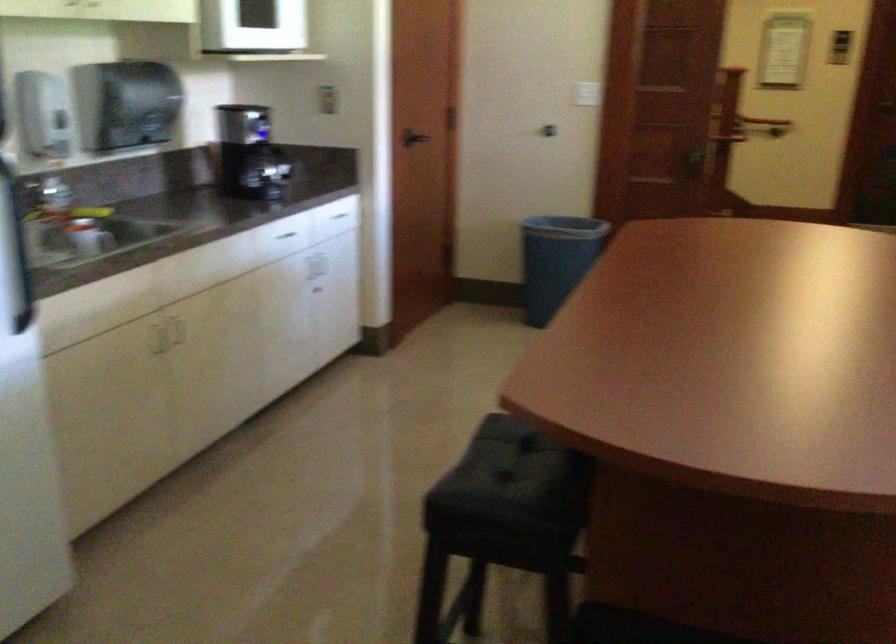
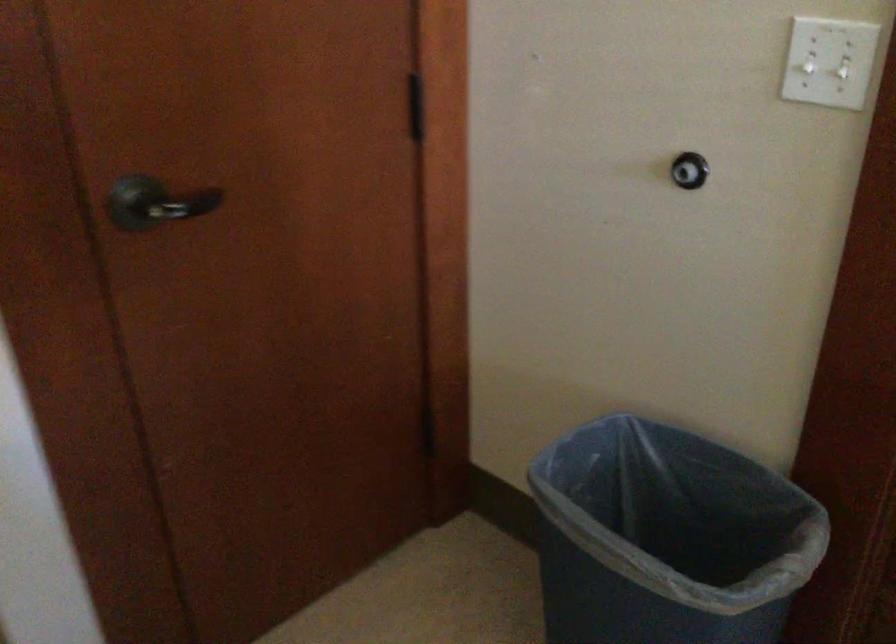
The point at [600,73] is marked in the first image. Where is the corresponding point in the second image?

(807, 67)